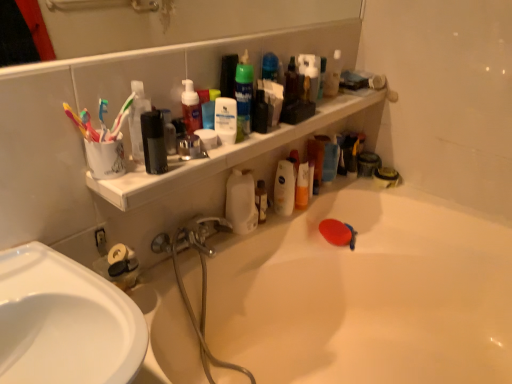
Locate an element on the screen. This screenshot has height=384, width=512. white glossy mirror at upper center is located at coordinates (182, 23).

The height and width of the screenshot is (384, 512). Describe the element at coordinates (333, 75) in the screenshot. I see `translucent plastic spray bottle at upper center, placed as the 5th cleaning product when sorted from left to right` at that location.

Locate an element on the screen. white matte bottle at center, which ranks as the 2th cleaning product in back-to-front order is located at coordinates (241, 202).

What is the approximate height of silver metallic faucet at center?

4.82 inches.

Find the location of a particular element. The height and width of the screenshot is (384, 512). silver metallic faucet at center is located at coordinates (190, 236).

The image size is (512, 384). What are the coordinates of `multicolored plastic toothbrushes at left, the 2th toothbrush from the right` in the screenshot? It's located at (76, 121).

This screenshot has width=512, height=384. I want to click on white plastic shelf at upper center, so click(x=225, y=154).

Is the position of white glossy bathtub at upper center more distant than that of multicolored plastic toothbrushes at left, which ranks as the 1th toothbrush in left-to-right order?

No, the depth of white glossy bathtub at upper center is less than that of multicolored plastic toothbrushes at left, which ranks as the 1th toothbrush in left-to-right order.

Is white glossy bathtub at upper center looking in the opposite direction of multicolored plastic toothbrushes at left, the 2th toothbrush from the right?

No, white glossy bathtub at upper center is not facing the opposite direction of multicolored plastic toothbrushes at left, the 2th toothbrush from the right.

Considering the relative positions of white glossy bathtub at upper center and multicolored plastic toothbrushes at left, the 2th toothbrush from the right, in the image provided, is white glossy bathtub at upper center to the left of multicolored plastic toothbrushes at left, the 2th toothbrush from the right, from the viewer's perspective?

In fact, white glossy bathtub at upper center is to the right of multicolored plastic toothbrushes at left, the 2th toothbrush from the right.

From the image's perspective, would you say white glossy bathtub at upper center is shown under multicolored plastic toothbrushes at left, the 2th toothbrush from the right?

Yes.

Does point (280, 129) appear closer or farther from the camera than point (251, 78)?

Clearly, point (280, 129) is more distant from the camera than point (251, 78).

From a real-world perspective, is white plastic shelf at upper center over green matte shaving cream can at upper center, which ranks as the 4th cleaning product in left-to-right order?

Incorrect, from a real-world perspective, white plastic shelf at upper center is lower than green matte shaving cream can at upper center, which ranks as the 4th cleaning product in left-to-right order.

Who is shorter, white plastic shelf at upper center or green matte shaving cream can at upper center, which ranks as the third cleaning product in front-to-back order?

white plastic shelf at upper center.

Is white plastic shelf at upper center outside of green matte shaving cream can at upper center, which ranks as the 3th cleaning product in back-to-front order?

Yes, white plastic shelf at upper center is located beyond the bounds of green matte shaving cream can at upper center, which ranks as the 3th cleaning product in back-to-front order.

How different are the orientations of white glossy mirror at upper center and translucent plastic spray bottle at upper center, which appears as the 1th cleaning product when viewed from the right, in degrees?

The angular difference between white glossy mirror at upper center and translucent plastic spray bottle at upper center, which appears as the 1th cleaning product when viewed from the right, is 0.591 degrees.

From the image's perspective, is white glossy mirror at upper center positioned above or below translucent plastic spray bottle at upper center, which appears as the 1th cleaning product when viewed from the right?

From the image's perspective, white glossy mirror at upper center appears above translucent plastic spray bottle at upper center, which appears as the 1th cleaning product when viewed from the right.

Considering the positions of objects white glossy mirror at upper center and translucent plastic spray bottle at upper center, placed as the 5th cleaning product when sorted from left to right, in the image provided, who is more to the left, white glossy mirror at upper center or translucent plastic spray bottle at upper center, placed as the 5th cleaning product when sorted from left to right,?

Positioned to the left is white glossy mirror at upper center.

Are white glossy mirror at upper center and translucent plastic spray bottle at upper center, placed as the 5th cleaning product when sorted from left to right, located far from each other?

No, white glossy mirror at upper center is not far from translucent plastic spray bottle at upper center, placed as the 5th cleaning product when sorted from left to right.

Are multicolored plastic toothbrushes at left, which ranks as the 1th toothbrush in left-to-right order, and white glossy mirror at upper center far apart?

multicolored plastic toothbrushes at left, which ranks as the 1th toothbrush in left-to-right order, is positioned a significant distance from white glossy mirror at upper center.

Is point (67, 104) positioned behind point (53, 37)?

No, (67, 104) is closer to viewer.

Considering the relative positions of multicolored plastic toothbrushes at left, the 2th toothbrush from the right, and white glossy mirror at upper center in the image provided, is multicolored plastic toothbrushes at left, the 2th toothbrush from the right, to the left or to the right of white glossy mirror at upper center?

multicolored plastic toothbrushes at left, the 2th toothbrush from the right, is to the left of white glossy mirror at upper center.

Are translucent plastic toothbrush at upper left, positioned as the 2th toothbrush in left-to-right order, and white matte bottle at center, which is the third cleaning product in right-to-left order, beside each other?

They are not placed beside each other.

I want to click on the 5th cleaning product below the translucent plastic toothbrush at upper left, the first toothbrush in the right-to-left sequence (from a real-world perspective), so click(x=241, y=202).

Is the depth of translucent plastic toothbrush at upper left, positioned as the 2th toothbrush in left-to-right order, less than that of white matte bottle at center, placed as the 4th cleaning product when sorted from front to back?

Yes, the depth of translucent plastic toothbrush at upper left, positioned as the 2th toothbrush in left-to-right order, is less than that of white matte bottle at center, placed as the 4th cleaning product when sorted from front to back.

Considering the sizes of objects translucent plastic toothbrush at upper left, positioned as the 2th toothbrush in left-to-right order, and white matte bottle at center, which ranks as the third cleaning product in left-to-right order, in the image provided, who is thinner, translucent plastic toothbrush at upper left, positioned as the 2th toothbrush in left-to-right order, or white matte bottle at center, which ranks as the third cleaning product in left-to-right order,?

Thinner between the two is translucent plastic toothbrush at upper left, positioned as the 2th toothbrush in left-to-right order.

Which point is more distant from viewer, (73, 120) or (405, 341)?

The point (405, 341) is farther.

Between multicolored plastic toothbrushes at left, the 2th toothbrush from the right, and white glossy bathtub at upper center, which one appears on the left side from the viewer's perspective?

multicolored plastic toothbrushes at left, the 2th toothbrush from the right, is more to the left.

Considering the sizes of objects multicolored plastic toothbrushes at left, which ranks as the 1th toothbrush in left-to-right order, and white glossy bathtub at upper center in the image provided, who is bigger, multicolored plastic toothbrushes at left, which ranks as the 1th toothbrush in left-to-right order, or white glossy bathtub at upper center?

With larger size is white glossy bathtub at upper center.

Could you tell me if multicolored plastic toothbrushes at left, which ranks as the 1th toothbrush in left-to-right order, is turned towards white glossy bathtub at upper center?

No, multicolored plastic toothbrushes at left, which ranks as the 1th toothbrush in left-to-right order, does not turn towards white glossy bathtub at upper center.

Is silver metallic faucet at center positioned with its back to white matte bottle at center, which is the third cleaning product in right-to-left order?

No, silver metallic faucet at center is not facing the opposite direction of white matte bottle at center, which is the third cleaning product in right-to-left order.

Between silver metallic faucet at center and white matte bottle at center, placed as the 4th cleaning product when sorted from front to back, which one has larger size?

With larger size is silver metallic faucet at center.

In the image, is silver metallic faucet at center positioned in front of or behind white matte bottle at center, which is the third cleaning product in right-to-left order?

silver metallic faucet at center is positioned closer to the viewer than white matte bottle at center, which is the third cleaning product in right-to-left order.

Is silver metallic faucet at center not near white matte bottle at center, which ranks as the 2th cleaning product in back-to-front order?

silver metallic faucet at center is actually quite close to white matte bottle at center, which ranks as the 2th cleaning product in back-to-front order.

Identify the location of the 1st toothbrush behind the white glossy bathtub at upper center, starting your count from the anchor. (76, 121).

Locate an element on the screen. This screenshot has height=384, width=512. shelve in front of the green matte shaving cream can at upper center, which ranks as the 4th cleaning product in left-to-right order is located at coordinates (225, 154).

From the image, which object appears to be farther from white matte lotion at center, the second cleaning product when ordered from left to right, green matte shaving cream can at upper center, which ranks as the 4th cleaning product in left-to-right order, or white glossy mirror at upper center?

white glossy mirror at upper center lies further to white matte lotion at center, the second cleaning product when ordered from left to right, than the other object.

Based on their spatial positions, is white matte lotion at center, the second cleaning product when ordered from left to right, or multicolored plastic toothbrushes at left, which ranks as the 1th toothbrush in left-to-right order, further from translucent plastic spray bottle at upper center, the 5th cleaning product when ordered from front to back?

Based on the image, multicolored plastic toothbrushes at left, which ranks as the 1th toothbrush in left-to-right order, appears to be further to translucent plastic spray bottle at upper center, the 5th cleaning product when ordered from front to back.

Based on their spatial positions, is white matte lotion at center, positioned as the fourth cleaning product in back-to-front order, or silver metallic faucet at center closer to multicolored plastic toothbrushes at left, the 2th toothbrush from the right?

white matte lotion at center, positioned as the fourth cleaning product in back-to-front order.

Based on their spatial positions, is white glossy mirror at upper center or translucent plastic toothbrush at upper left, positioned as the 2th toothbrush in left-to-right order, further from green matte shaving cream can at upper center, which ranks as the third cleaning product in front-to-back order?

Among the two, white glossy mirror at upper center is located further to green matte shaving cream can at upper center, which ranks as the third cleaning product in front-to-back order.

Based on their spatial positions, is white glossy mirror at upper center or silver metallic faucet at center further from matte red soap dispenser at upper center, the 1th cleaning product positioned from the left?

white glossy mirror at upper center is further to matte red soap dispenser at upper center, the 1th cleaning product positioned from the left.

Looking at the image, which one is located further to matte red soap dispenser at upper center, which is the fifth cleaning product from right to left, white plastic shelf at upper center or multicolored plastic toothbrushes at left, the 2th toothbrush from the right?

Based on the image, white plastic shelf at upper center appears to be further to matte red soap dispenser at upper center, which is the fifth cleaning product from right to left.

From the image, which object appears to be farther from white glossy mirror at upper center, green matte shaving cream can at upper center, which ranks as the 4th cleaning product in left-to-right order, or translucent plastic spray bottle at upper center, placed as the 5th cleaning product when sorted from left to right?

green matte shaving cream can at upper center, which ranks as the 4th cleaning product in left-to-right order, lies further to white glossy mirror at upper center than the other object.

Considering their positions, is white plastic shelf at upper center positioned closer to translucent plastic spray bottle at upper center, which appears as the 1th cleaning product when viewed from the right, than translucent plastic toothbrush at upper left, the first toothbrush in the right-to-left sequence?

white plastic shelf at upper center.

Find the location of `tap between multicolored plastic toothbrushes at left, the 2th toothbrush from the right, and white glossy bathtub at upper center from left to right`. tap between multicolored plastic toothbrushes at left, the 2th toothbrush from the right, and white glossy bathtub at upper center from left to right is located at coordinates (190, 236).

Where is `toothbrush located between multicolored plastic toothbrushes at left, the 2th toothbrush from the right, and white matte lotion at center, acting as the second cleaning product starting from the front, in the depth direction`? This screenshot has width=512, height=384. toothbrush located between multicolored plastic toothbrushes at left, the 2th toothbrush from the right, and white matte lotion at center, acting as the second cleaning product starting from the front, in the depth direction is located at coordinates (119, 125).

Locate an element on the screen. The width and height of the screenshot is (512, 384). shelve between white glossy mirror at upper center and translucent plastic spray bottle at upper center, placed as the 5th cleaning product when sorted from left to right, from front to back is located at coordinates (225, 154).

Identify the location of cleaning product between multicolored plastic toothbrushes at left, the 2th toothbrush from the right, and white matte lotion at center, acting as the second cleaning product starting from the front, from left to right. The width and height of the screenshot is (512, 384). (191, 108).